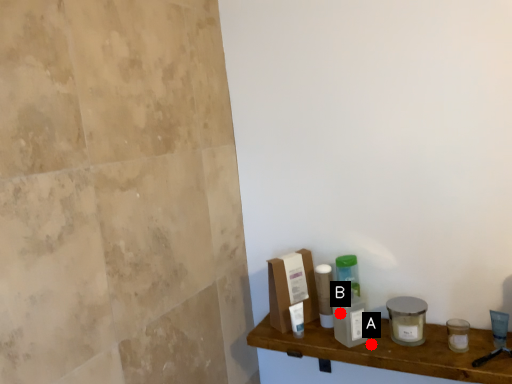
Question: Two points are circled on the image, labeled by A and B beside each circle. Which point is farther to the camera?

Choices:
 (A) A is further
 (B) B is further

Answer: (B)